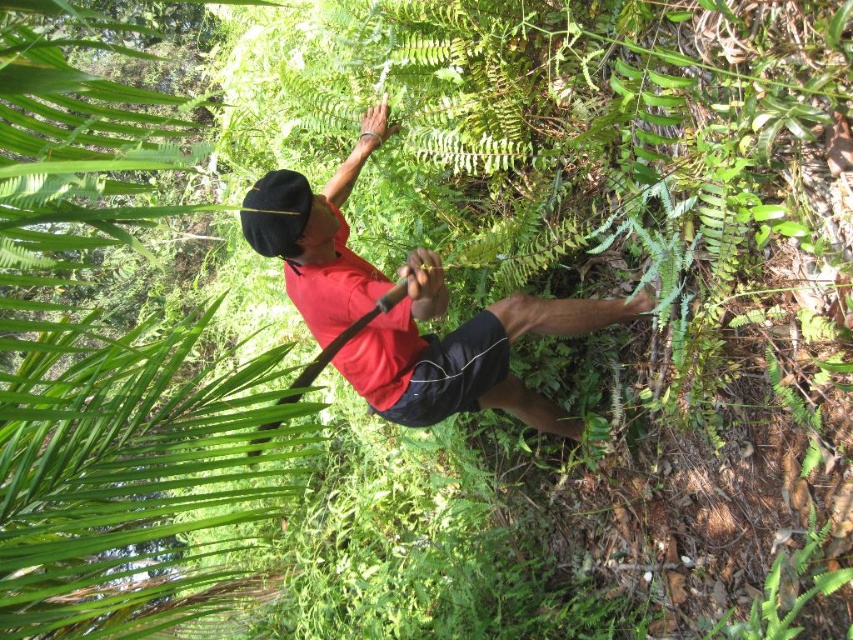
Who is taller, green leafy tree at upper left or red matte shirt at center?

With more height is green leafy tree at upper left.

Who is shorter, green leafy tree at upper left or red matte shirt at center?

red matte shirt at center

Measure the distance between point [73,250] and camera.

The distance of point [73,250] from camera is 2.23 meters.

The width and height of the screenshot is (853, 640). What are the coordinates of `green leafy tree at upper left` in the screenshot? It's located at (109, 474).